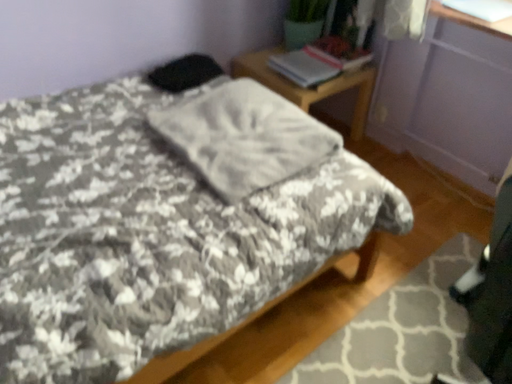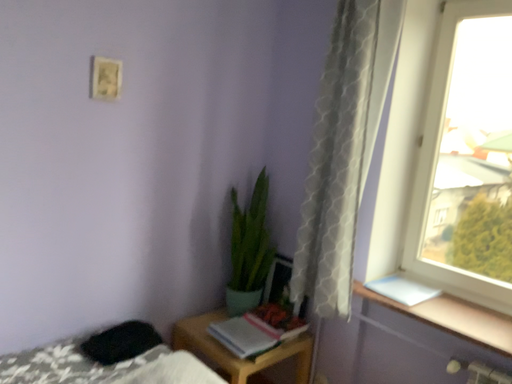
Question: Which way did the camera rotate in the video?

Choices:
 (A) rotated upward
 (B) rotated downward

Answer: (A)